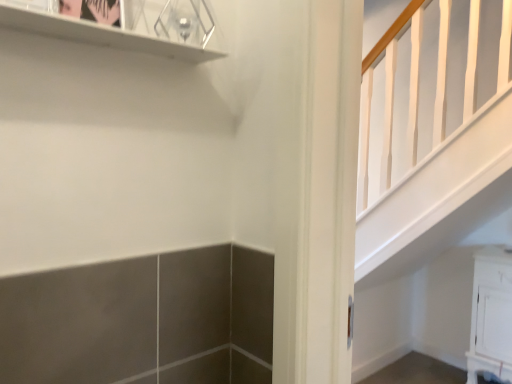
In order to face white glossy shelf at upper left, should I rotate leftwards or rightwards?

Turn left by 17.548 degrees to look at white glossy shelf at upper left.

What do you see at coordinates (100, 34) in the screenshot? I see `white glossy shelf at upper left` at bounding box center [100, 34].

The width and height of the screenshot is (512, 384). Find the location of `white glossy shelf at upper left`. white glossy shelf at upper left is located at coordinates (100, 34).

The height and width of the screenshot is (384, 512). Find the location of `white glossy shelf at upper left`. white glossy shelf at upper left is located at coordinates (100, 34).